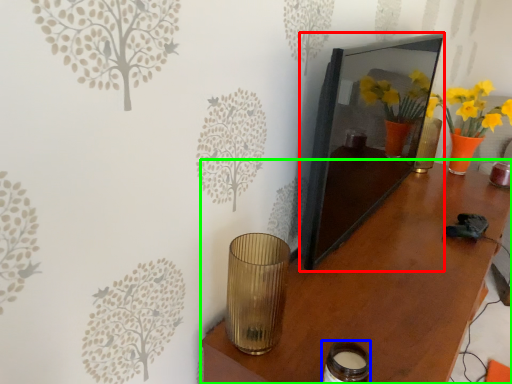
Question: Considering the real-world distances, which object is closest to picture frame (highlighted by a red box)? candle holder (highlighted by a blue box) or table (highlighted by a green box).

Choices:
 (A) candle holder
 (B) table

Answer: (B)